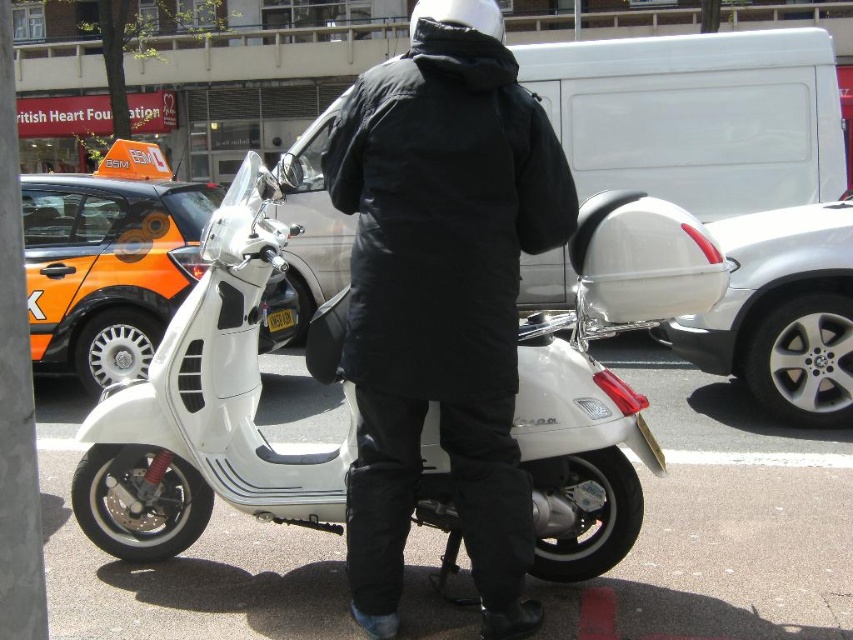
Question: Does white matte scooter at center appear under black plastic license plate at center?

Choices:
 (A) yes
 (B) no

Answer: (A)

Question: Which is nearer to the black plastic license plate at center?

Choices:
 (A) black matte jacket at center
 (B) white matte scooter at center

Answer: (B)

Question: Among these objects, which one is nearest to the camera?

Choices:
 (A) black matte jacket at center
 (B) black plastic license plate at center

Answer: (A)

Question: Can you confirm if white matte scooter at center is positioned to the right of black plastic license plate at center?

Choices:
 (A) yes
 (B) no

Answer: (A)

Question: Is white matte scooter at center to the left of black matte jacket at center from the viewer's perspective?

Choices:
 (A) no
 (B) yes

Answer: (B)

Question: Which object is closer to the camera taking this photo?

Choices:
 (A) black matte jacket at center
 (B) black plastic license plate at center

Answer: (A)